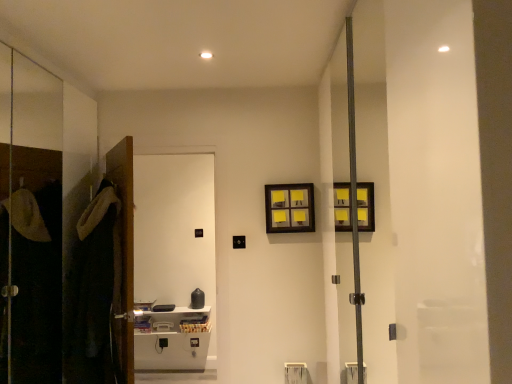
The width and height of the screenshot is (512, 384). What do you see at coordinates (174, 255) in the screenshot?
I see `white glossy cabinet at left` at bounding box center [174, 255].

Locate an element on the screen. white glossy cabinet at left is located at coordinates (174, 255).

Is wooden picture frame at upper center at the back of dark brown plush robe at left?

That's not correct — dark brown plush robe at left is not looking away from wooden picture frame at upper center.

In the scene shown: Which is correct: dark brown plush robe at left is inside wooden picture frame at upper center, or outside of it?

dark brown plush robe at left is spatially situated outside wooden picture frame at upper center.

From a real-world perspective, who is located higher, dark brown plush robe at left or wooden picture frame at upper center?

wooden picture frame at upper center, from a real-world perspective.

Is dark brown plush robe at left wider or thinner than wooden picture frame at upper center?

In the image, dark brown plush robe at left appears to be wider than wooden picture frame at upper center.

Measure the distance between brown wooden door at left and dark brown plush robe at left.

A distance of 6.15 inches exists between brown wooden door at left and dark brown plush robe at left.

Could you tell me if brown wooden door at left is facing dark brown plush robe at left?

Yes.

Is brown wooden door at left wider or thinner than dark brown plush robe at left?

Considering their sizes, brown wooden door at left looks slimmer than dark brown plush robe at left.

Who is more distant, brown wooden door at left or dark brown plush robe at left?

brown wooden door at left is more distant.

This screenshot has height=384, width=512. I want to click on robe that is on the left side of wooden picture frame at upper center, so click(95, 294).

Considering the points (294, 194) and (113, 199), which point is in front, point (294, 194) or point (113, 199)?

The point (113, 199) is closer.

Consider the image. Which object is thinner, wooden picture frame at upper center or dark brown plush robe at left?

wooden picture frame at upper center.

Considering the positions of objects wooden picture frame at upper center and dark brown plush robe at left in the image provided, who is more to the right, wooden picture frame at upper center or dark brown plush robe at left?

wooden picture frame at upper center is more to the right.

Is wooden picture frame at upper center bigger or smaller than brown wooden door at left?

Considering their sizes, wooden picture frame at upper center takes up less space than brown wooden door at left.

Between point (266, 223) and point (128, 202), which one is positioned in front?

Point (128, 202)

From the image's perspective, which object appears higher, wooden picture frame at upper center or brown wooden door at left?

wooden picture frame at upper center is shown above in the image.

Is wooden picture frame at upper center not near brown wooden door at left?

Indeed, wooden picture frame at upper center is not near brown wooden door at left.

In the scene shown: Which is nearer, (114, 167) or (152, 170)?

The point (114, 167) is more forward.

Based on the photo, considering the sizes of objects brown wooden door at left and white glossy cabinet at left in the image provided, who is wider, brown wooden door at left or white glossy cabinet at left?

white glossy cabinet at left is wider.

Considering their positions, is brown wooden door at left located in front of or behind white glossy cabinet at left?

Clearly, brown wooden door at left is in front of white glossy cabinet at left.

Between brown wooden door at left and white glossy cabinet at left, which one has smaller size?

Smaller between the two is brown wooden door at left.

Which of these two, brown wooden door at left or wooden picture frame at upper center, stands taller?

Standing taller between the two is brown wooden door at left.

Is there a large distance between brown wooden door at left and wooden picture frame at upper center?

Yes, brown wooden door at left and wooden picture frame at upper center are located far from each other.

Which object is wider, brown wooden door at left or wooden picture frame at upper center?

wooden picture frame at upper center is wider.

Is white glossy cabinet at left looking in the opposite direction of dark brown plush robe at left?

No.

Is white glossy cabinet at left thinner than dark brown plush robe at left?

Correct, the width of white glossy cabinet at left is less than that of dark brown plush robe at left.

Is there a large distance between white glossy cabinet at left and dark brown plush robe at left?

Absolutely, white glossy cabinet at left is distant from dark brown plush robe at left.

Which is correct: white glossy cabinet at left is inside dark brown plush robe at left, or outside of it?

white glossy cabinet at left is located beyond the bounds of dark brown plush robe at left.

Image resolution: width=512 pixels, height=384 pixels. Find the location of `robe that appears below the wooden picture frame at upper center (from a real-world perspective)`. robe that appears below the wooden picture frame at upper center (from a real-world perspective) is located at coordinates (95, 294).

This screenshot has width=512, height=384. Identify the location of robe below the brown wooden door at left (from the image's perspective). (95, 294).

When comparing their distances from wooden picture frame at upper center, does dark brown plush robe at left or white glossy cabinet at left seem closer?

Among the two, dark brown plush robe at left is located nearer to wooden picture frame at upper center.

From the image, which object appears to be farther from brown wooden door at left, white glossy cabinet at left or wooden picture frame at upper center?

white glossy cabinet at left.

When comparing their distances from wooden picture frame at upper center, does white glossy cabinet at left or dark brown plush robe at left seem further?

Based on the image, white glossy cabinet at left appears to be further to wooden picture frame at upper center.

Considering their positions, is wooden picture frame at upper center positioned closer to white glossy cabinet at left than brown wooden door at left?

wooden picture frame at upper center is positioned closer to the anchor white glossy cabinet at left.

Based on their spatial positions, is wooden picture frame at upper center or dark brown plush robe at left further from white glossy cabinet at left?

dark brown plush robe at left.

Estimate the real-world distances between objects in this image. Which object is further from wooden picture frame at upper center, dark brown plush robe at left or brown wooden door at left?

The object further to wooden picture frame at upper center is dark brown plush robe at left.

Looking at the image, which one is located closer to brown wooden door at left, wooden picture frame at upper center or dark brown plush robe at left?

dark brown plush robe at left is positioned closer to the anchor brown wooden door at left.

When comparing their distances from brown wooden door at left, does white glossy cabinet at left or dark brown plush robe at left seem closer?

dark brown plush robe at left is closer to brown wooden door at left.

Identify the location of screen door between brown wooden door at left and wooden picture frame at upper center. The image size is (512, 384). (174, 255).

This screenshot has width=512, height=384. I want to click on door between dark brown plush robe at left and white glossy cabinet at left along the z-axis, so click(x=125, y=243).

The height and width of the screenshot is (384, 512). In order to click on door between dark brown plush robe at left and wooden picture frame at upper center from left to right in this screenshot , I will do `click(125, 243)`.

In order to click on screen door between dark brown plush robe at left and wooden picture frame at upper center in the horizontal direction in this screenshot , I will do `click(174, 255)`.